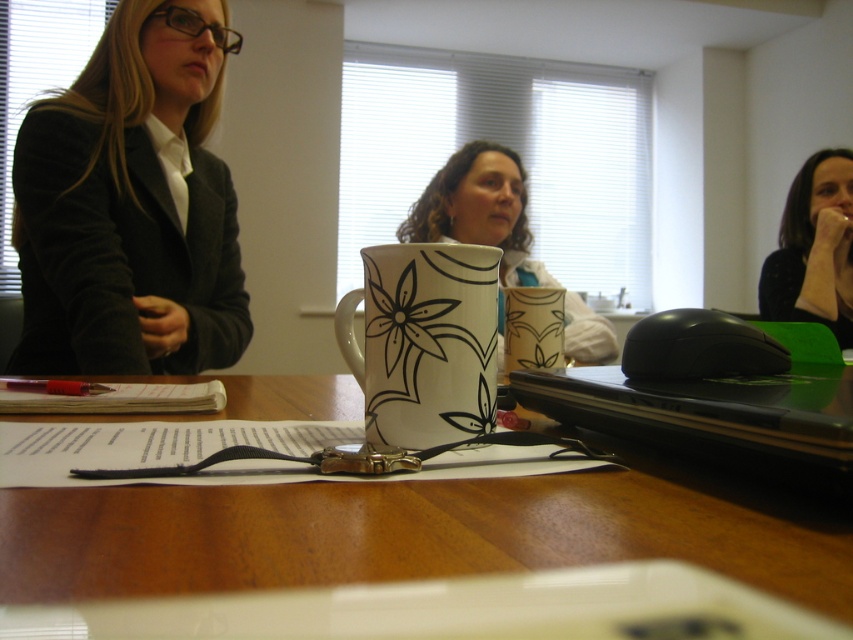
Question: Does matte black blazer at left appear on the left side of matte ceramic mug at center?

Choices:
 (A) yes
 (B) no

Answer: (A)

Question: Does floral ceramic mug at center have a smaller size compared to matte ceramic mug at center?

Choices:
 (A) yes
 (B) no

Answer: (B)

Question: Which point is farther from the camera taking this photo?

Choices:
 (A) (804, 532)
 (B) (445, 230)

Answer: (B)

Question: Which of these objects is positioned farthest from the floral ceramic mug at center?

Choices:
 (A) wooden table at center
 (B) matte black blazer at left

Answer: (A)

Question: Which point is farther from the camera taking this photo?

Choices:
 (A) (375, 568)
 (B) (836, 376)
 (C) (843, 204)
 (D) (399, 225)

Answer: (D)

Question: Is matte black blazer at left thinner than black plastic laptop at center?

Choices:
 (A) no
 (B) yes

Answer: (A)